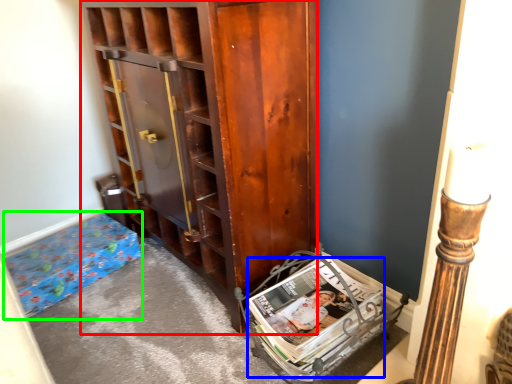
Question: Which is farther away from cabinetry (highlighted by a red box)? magazine (highlighted by a blue box) or furniture (highlighted by a green box)?

Choices:
 (A) magazine
 (B) furniture

Answer: (B)